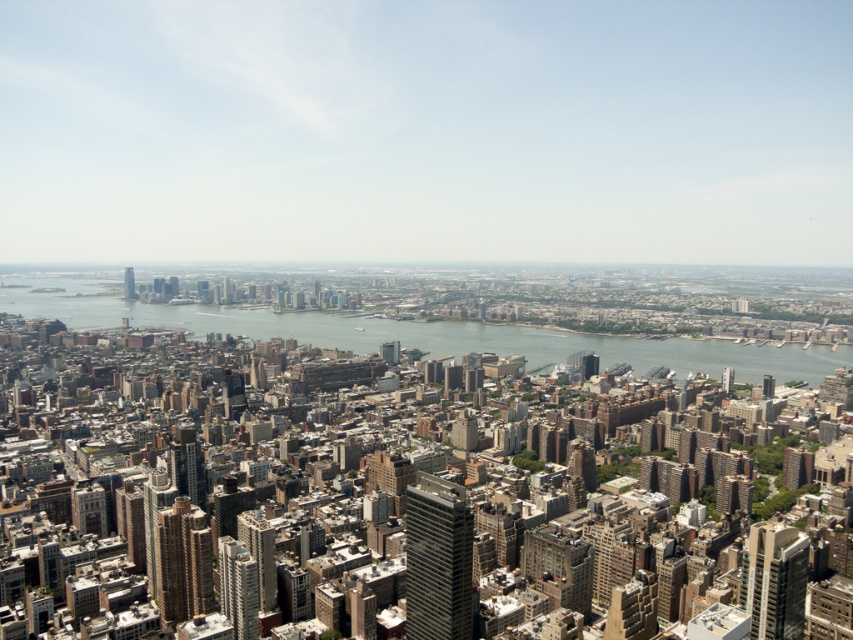
Question: Estimate the real-world distances between objects in this image. Which object is farther from the clear blue water at center?

Choices:
 (A) gray glass skyscraper at center
 (B) gold reflective skyscraper at center-left
 (C) glassy silver skyscraper at center-right

Answer: (B)

Question: Is gray glass skyscraper at center behind gold reflective skyscraper at center-left?

Choices:
 (A) no
 (B) yes

Answer: (A)

Question: Which point is closer to the camera?

Choices:
 (A) matte glass skyscraper at center-left
 (B) gold reflective skyscraper at center-left

Answer: (A)

Question: Which point appears farthest from the camera in this image?

Choices:
 (A) (233, 630)
 (B) (440, 522)
 (C) (762, 369)

Answer: (A)

Question: Does glassy silver skyscraper at center-right have a larger size compared to matte glass skyscraper at center-left?

Choices:
 (A) yes
 (B) no

Answer: (A)

Question: Is clear blue water at center thinner than matte glass skyscraper at center-left?

Choices:
 (A) no
 (B) yes

Answer: (A)